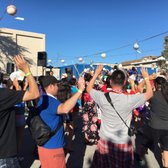
Locate an element on the screen. The width and height of the screenshot is (168, 168). lights hanging is located at coordinates (63, 62), (79, 60), (104, 58).